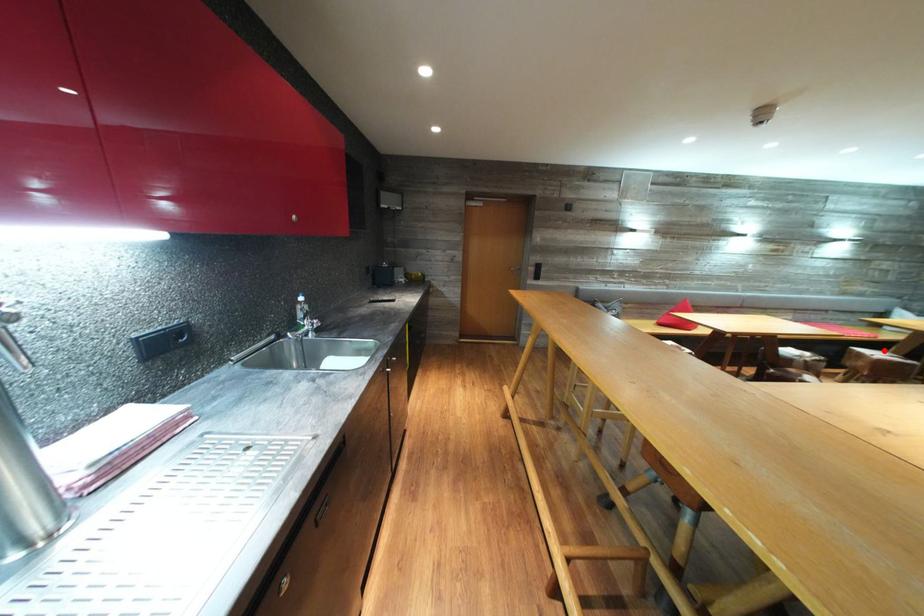
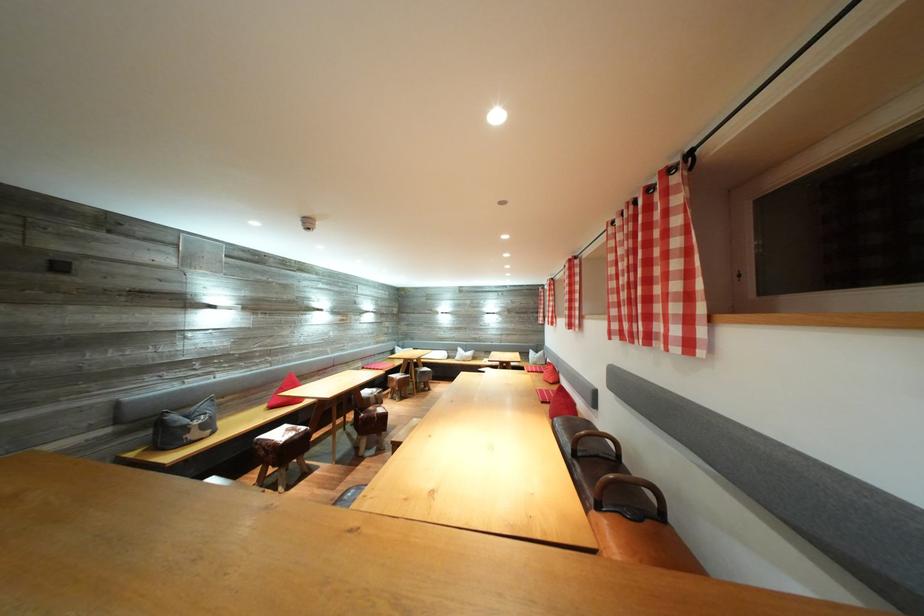
The point at the highlighted location is marked in the first image. Where is the corresponding point in the second image?

(403, 376)